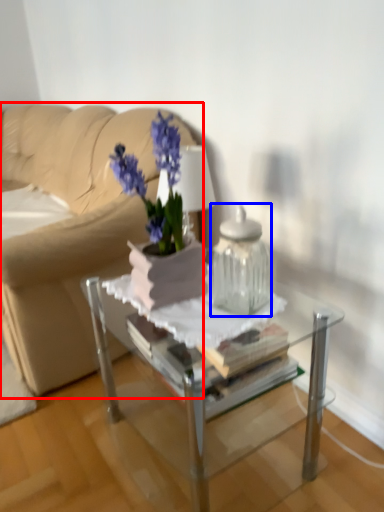
Question: Which object appears closest to the camera in this image, studio couch (highlighted by a red box) or vase (highlighted by a blue box)?

Choices:
 (A) studio couch
 (B) vase

Answer: (B)